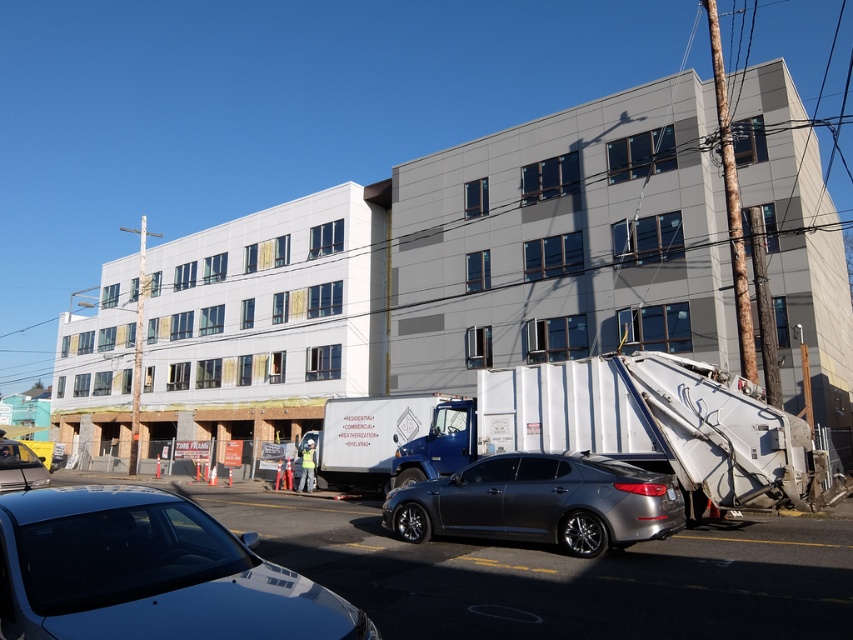
You are a delivery driver who needs to park your 1.5m tall truck between the shiny black sedan at lower left and the satin gray sedan at center. Can your truck fit vertically between them based on their heights?

The shiny black sedan at lower left has a lesser height compared to satin gray sedan at center. Since the truck is 1.5m tall, it can fit vertically between them as long as the space between the two sedans accommodates this height. However, the exact vertical clearance depends on the height difference between the two sedans. If the tallest sedan is taller than 1.5m, the truck may fit, but without knowing the exact heights, we can only confirm that the black sedan is shorter, so the space might be sufficient.

You are a delivery driver needing to park your 5.5 meter long truck between the satin gray sedan at center and the shiny silver sedan at lower left. Can you fit your truck in that space?

The satin gray sedan at center is 8.75 meters from the shiny silver sedan at lower left. Since your truck is 5.5 meters long, there is enough space to park between them as the distance between the two sedans is greater than the truck length.

You are a delivery driver trying to park your vehicle in the urban street scene. The parking spot is at coordinates point 0.786, 0.635. Is your satin gray sedan at center currently occupying that spot?

The satin gray sedan at center is located at point (541, 502), so yes, it is occupying the parking spot at those coordinates.